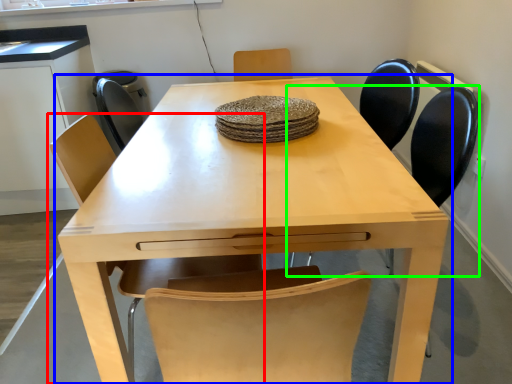
Question: Considering the real-world distances, which object is farthest from chair (highlighted by a red box)? table (highlighted by a blue box) or chair (highlighted by a green box)?

Choices:
 (A) table
 (B) chair

Answer: (B)